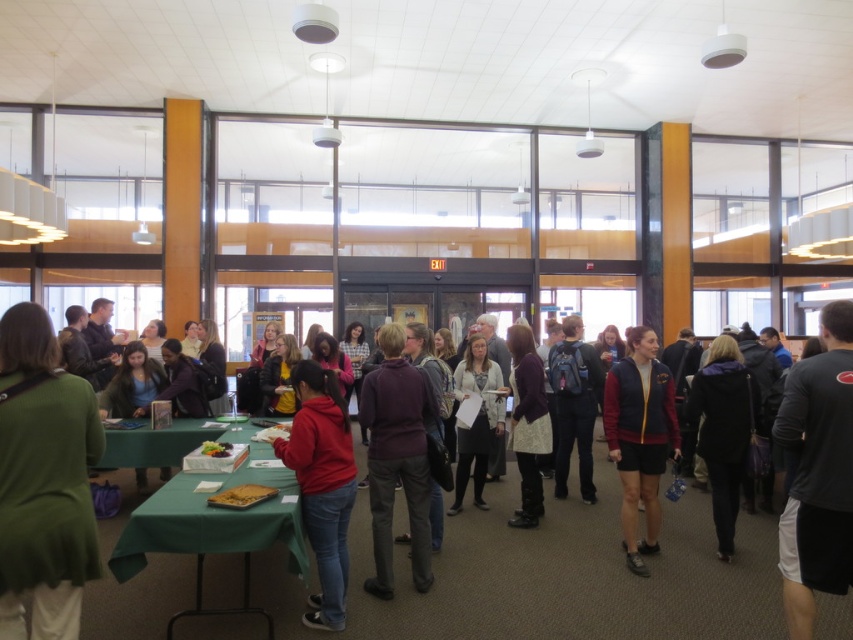
Who is taller, matte red hoodie at center or maroon fleece jacket at center?

Standing taller between the two is maroon fleece jacket at center.

Can you confirm if matte red hoodie at center is positioned above maroon fleece jacket at center?

Actually, matte red hoodie at center is below maroon fleece jacket at center.

Describe the element at coordinates (322, 484) in the screenshot. I see `matte red hoodie at center` at that location.

The height and width of the screenshot is (640, 853). Find the location of `matte red hoodie at center`. matte red hoodie at center is located at coordinates (322, 484).

Is point (778, 556) in front of point (737, 497)?

Yes.

Who is more distant from viewer, [790,426] or [701,449]?

The point [701,449] is more distant.

Describe the element at coordinates (817, 472) in the screenshot. This screenshot has height=640, width=853. I see `black cotton shirt at right` at that location.

Identify the location of black cotton shirt at right. The height and width of the screenshot is (640, 853). (817, 472).

Does green sweater at left have a lesser width compared to matte purple sweater at center?

No.

Which of these two, green sweater at left or matte purple sweater at center, stands shorter?

Standing shorter between the two is green sweater at left.

This screenshot has height=640, width=853. What do you see at coordinates (44, 481) in the screenshot?
I see `green sweater at left` at bounding box center [44, 481].

Identify the location of green sweater at left. The height and width of the screenshot is (640, 853). (44, 481).